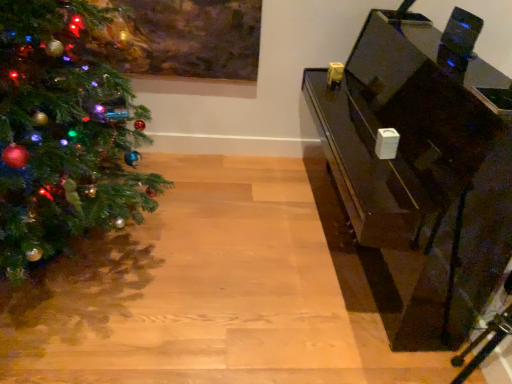
The height and width of the screenshot is (384, 512). I want to click on vacant area situated below glossy black piano at right (from a real-world perspective), so click(332, 246).